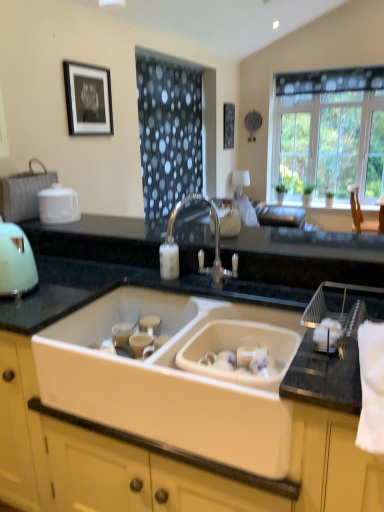
Question: Considering the positions of matte green kettle at left and clear glass window at upper right in the image, is matte green kettle at left wider or thinner than clear glass window at upper right?

Choices:
 (A) thin
 (B) wide

Answer: (B)

Question: From a real-world perspective, is matte green kettle at left above or below clear glass window at upper right?

Choices:
 (A) above
 (B) below

Answer: (B)

Question: Which of these objects is positioned closest to the black matte picture frame at upper center, marked as the 1th picture frame in a right-to-left arrangement?

Choices:
 (A) white ceramic sink at center
 (B) black matte picture frame at upper left, the 2th picture frame when ordered from top to bottom
 (C) matte green kettle at left
 (D) clear glass window at upper right
 (E) satin nickel faucet at center

Answer: (D)

Question: Which is farther from the satin nickel faucet at center?

Choices:
 (A) black matte picture frame at upper left, arranged as the 2th picture frame when viewed from the back
 (B) clear glass window at upper right
 (C) black matte picture frame at upper center, arranged as the 2th picture frame when viewed from the front
 (D) white ceramic sink at center
 (E) matte green kettle at left

Answer: (B)